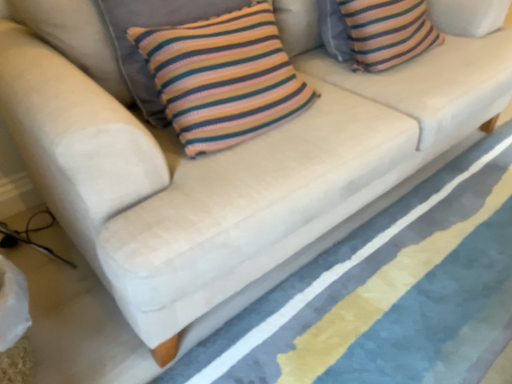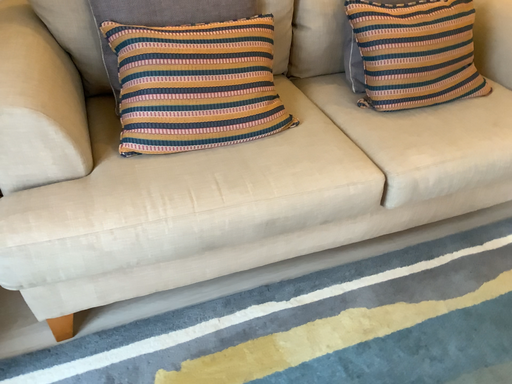
Question: How did the camera likely rotate when shooting the video?

Choices:
 (A) rotated left
 (B) rotated right

Answer: (A)